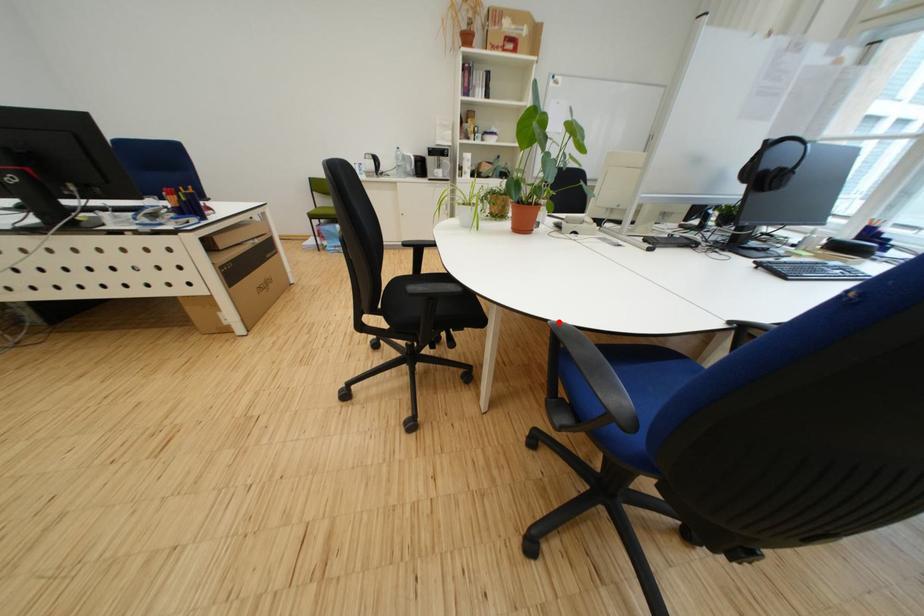
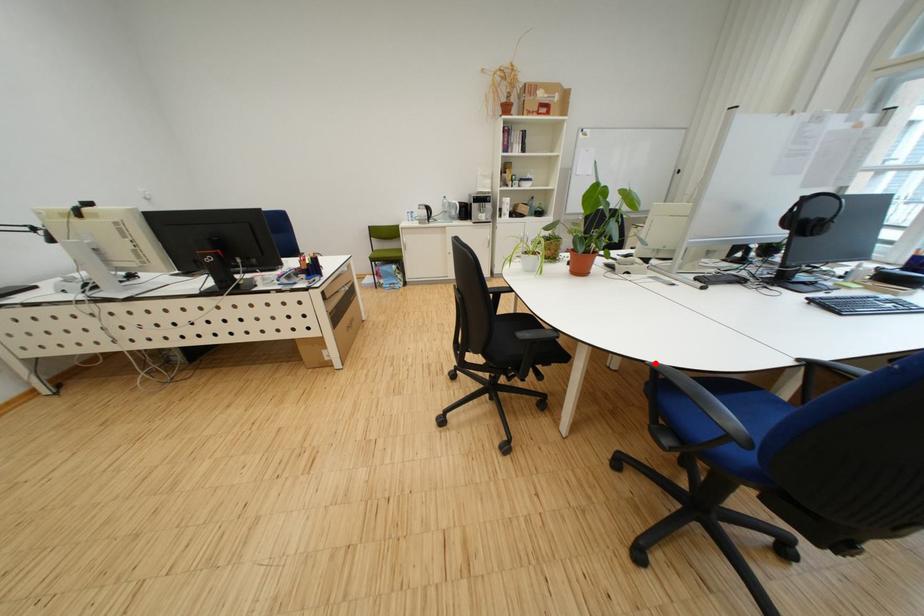
I am providing you with two images of the same scene from different viewpoints. A red point is marked on the first image and another point is marked on the second image. Does the point marked in image1 correspond to the same location as the one in image2?

Yes